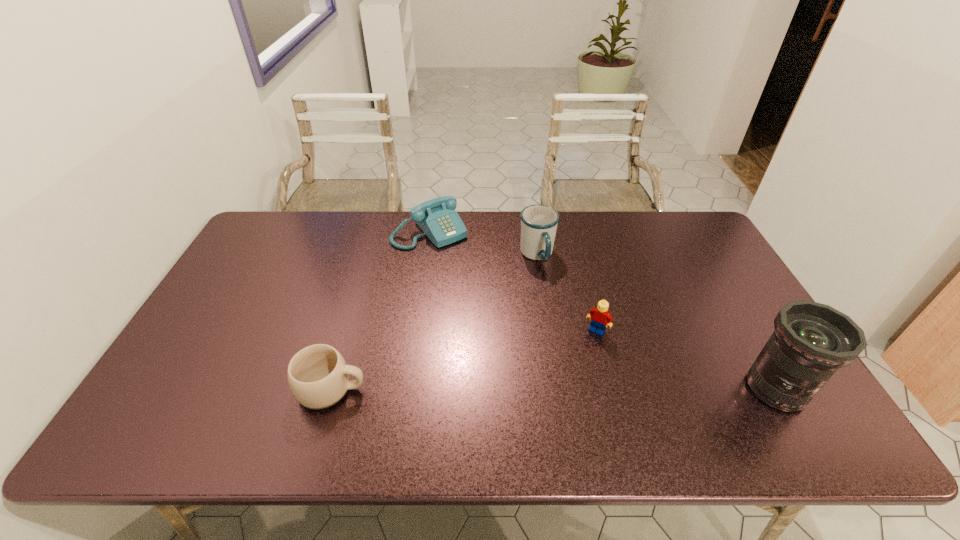
Find the location of a particular element. This screenshot has height=540, width=960. mug that is at the far edge is located at coordinates point(539,223).

Locate an element on the screen. This screenshot has width=960, height=540. telephone located in the far edge section of the desktop is located at coordinates (437, 218).

Locate an element on the screen. The width and height of the screenshot is (960, 540). mug located in the near edge section of the desktop is located at coordinates (318, 376).

At what (x,y) coordinates should I click in order to perform the action: click on telephoto lens at the near edge. Please return your answer as a coordinate pair (x, y). The height and width of the screenshot is (540, 960). Looking at the image, I should click on [811, 341].

Identify the location of object present at the right edge. Image resolution: width=960 pixels, height=540 pixels. (811, 341).

Identify the location of object positioned at the near right corner. (811, 341).

The width and height of the screenshot is (960, 540). In order to click on free space at the far edge of the desktop in this screenshot , I will do `click(377, 243)`.

Where is `vacant space at the near edge of the desktop`? The width and height of the screenshot is (960, 540). vacant space at the near edge of the desktop is located at coordinates (660, 406).

Where is `vacant space at the left edge of the desktop`? The height and width of the screenshot is (540, 960). vacant space at the left edge of the desktop is located at coordinates (244, 346).

Find the location of a particular element. The image size is (960, 540). free space at the right edge of the desktop is located at coordinates (707, 255).